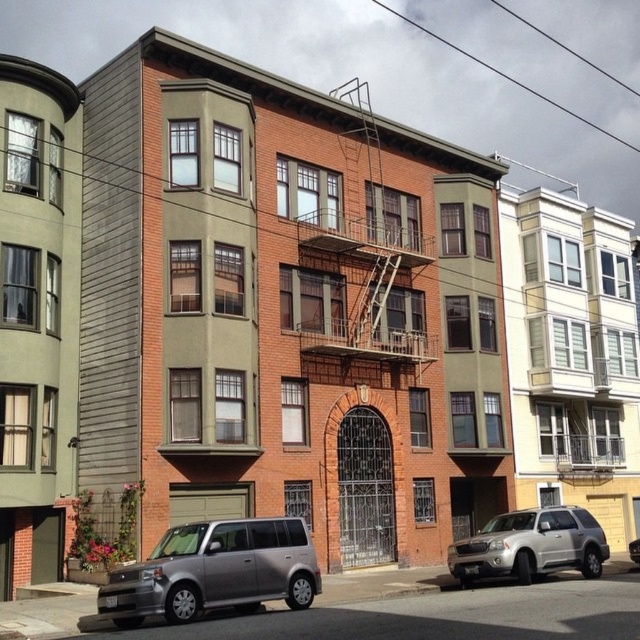
Consider the image. Between brick fire escape at center and silver metallic suv at center, which one is positioned higher?

Positioned higher is brick fire escape at center.

Between brick fire escape at center and silver metallic suv at center, which one appears on the left side from the viewer's perspective?

From the viewer's perspective, brick fire escape at center appears more on the left side.

Find the location of a particular element. The image size is (640, 640). brick fire escape at center is located at coordinates (371, 244).

Between satin silver minivan at lower left and silver metallic suv at center, which one has more height?

Standing taller between the two is silver metallic suv at center.

What do you see at coordinates (214, 572) in the screenshot? Image resolution: width=640 pixels, height=640 pixels. I see `satin silver minivan at lower left` at bounding box center [214, 572].

This screenshot has width=640, height=640. I want to click on satin silver minivan at lower left, so click(214, 572).

Does satin silver minivan at lower left have a larger size compared to brick fire escape at center?

Incorrect, satin silver minivan at lower left is not larger than brick fire escape at center.

In order to click on satin silver minivan at lower left in this screenshot , I will do `click(214, 572)`.